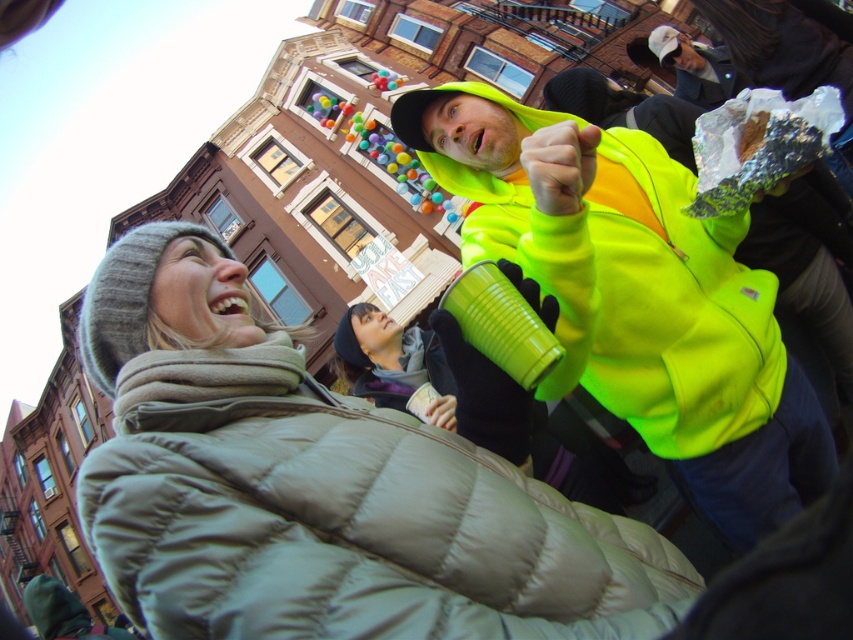
You are standing in the middle of the lively street scene and want to reach both the point at coordinates (289, 403) and the point at (553, 273). Which point should you go to first if you want to reach the one closer to you first?

You should go to point (289, 403) first because it is closer to you than point (553, 273).